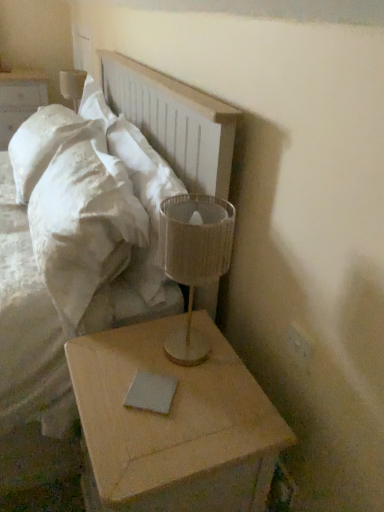
The image size is (384, 512). What are the coordinates of `free region under translucent fabric lampshade at right, positioned as the 2th table lamp in top-to-bottom order (from a real-world perspective)` in the screenshot? It's located at (195, 348).